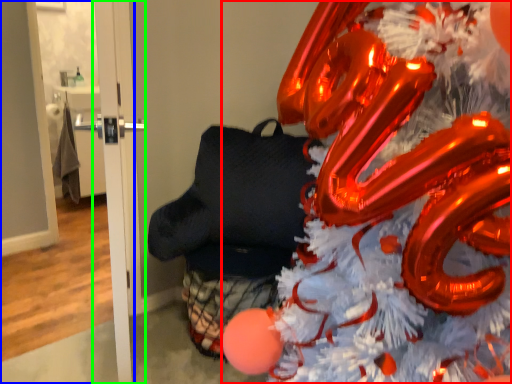
Question: Which object is positioned closest to christmas tree (highlighted by a red box)? Select from door (highlighted by a blue box) and door (highlighted by a green box).

Choices:
 (A) door
 (B) door

Answer: (B)